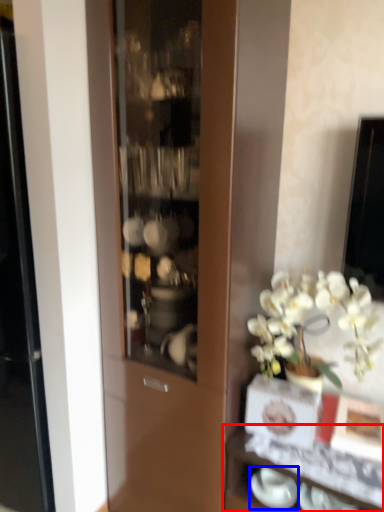
Question: Which of the following is the farthest to the observer, shelf (highlighted by a red box) or tableware (highlighted by a blue box)?

Choices:
 (A) shelf
 (B) tableware

Answer: (B)